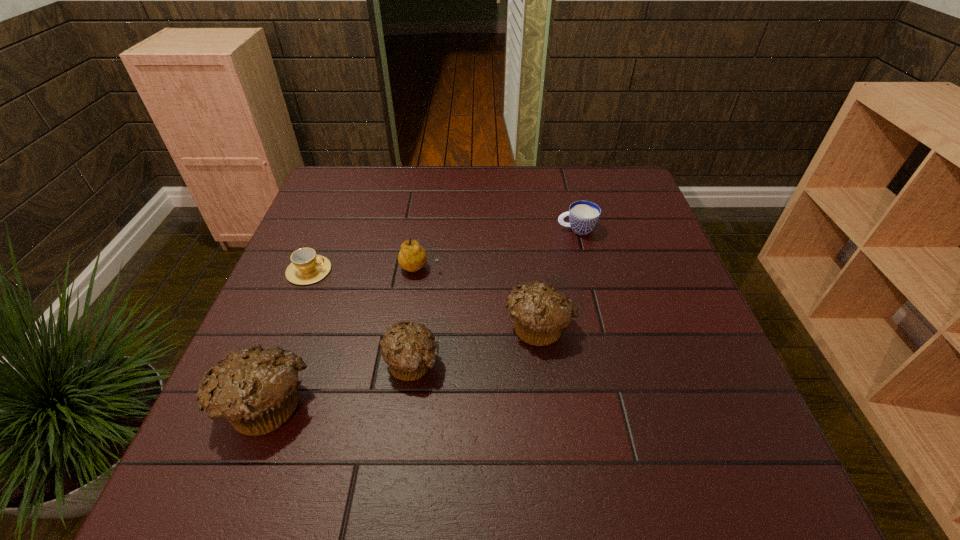
Where is `vacant space situated on the back of the second muffin from left to right`? vacant space situated on the back of the second muffin from left to right is located at coordinates (423, 276).

Find the location of `free region located on the back of the fifth object from left to right`. free region located on the back of the fifth object from left to right is located at coordinates (525, 220).

The height and width of the screenshot is (540, 960). In order to click on vacant space situated 0.110m on the side of the rightmost object with the handle in this screenshot , I will do `click(516, 229)`.

What are the coordinates of `free space located on the side of the rightmost object with the handle` in the screenshot? It's located at (462, 229).

The height and width of the screenshot is (540, 960). Find the location of `blank area located on the side of the rightmost object with the handle`. blank area located on the side of the rightmost object with the handle is located at coordinates (492, 229).

Locate an element on the screen. The width and height of the screenshot is (960, 540). free space located 0.260m on the right of the pear is located at coordinates (544, 268).

Find the location of a particular element. vacant space positioned with the handle on the side of the shortest object is located at coordinates (368, 271).

Locate an element on the screen. The height and width of the screenshot is (540, 960). object present at the near edge is located at coordinates (254, 389).

The height and width of the screenshot is (540, 960). What are the coordinates of `muffin positioned at the left edge` in the screenshot? It's located at (254, 389).

This screenshot has width=960, height=540. What are the coordinates of `cup positioned at the left edge` in the screenshot? It's located at (306, 268).